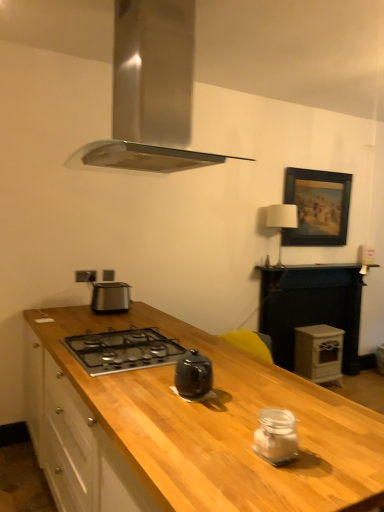
You are a GUI agent. You are given a task and a screenshot of the screen. Output one action in this format:
    pyautogui.click(x=<x>, y=<y>)
    Task: Click on the vacant area that is in front of clear glass jar at center, which appears as the first kitchen appliance when viewed from the front
    
    Given the screenshot: What is the action you would take?
    pyautogui.click(x=292, y=488)